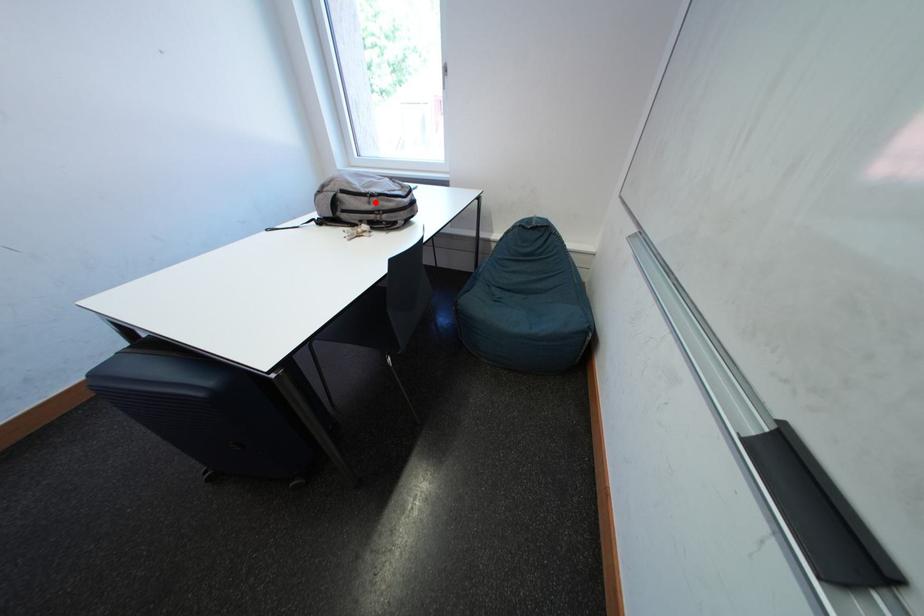
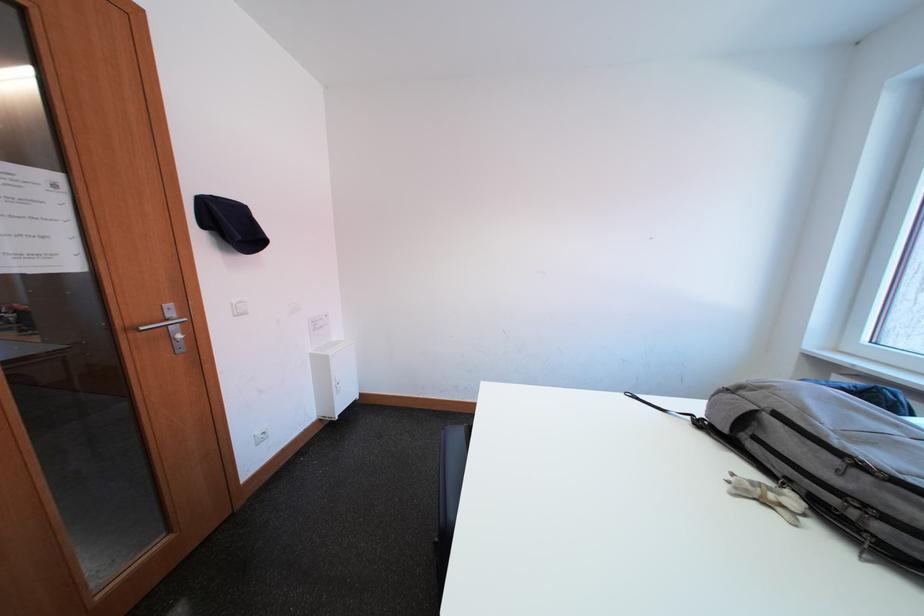
Question: I am providing you with two images of the same scene from different viewpoints. Image1 has a red point marked. In image2, the corresponding 3D location appears at what relative position? Reply with the corresponding letter.

Choices:
 (A) Closer
 (B) Farther

Answer: (B)